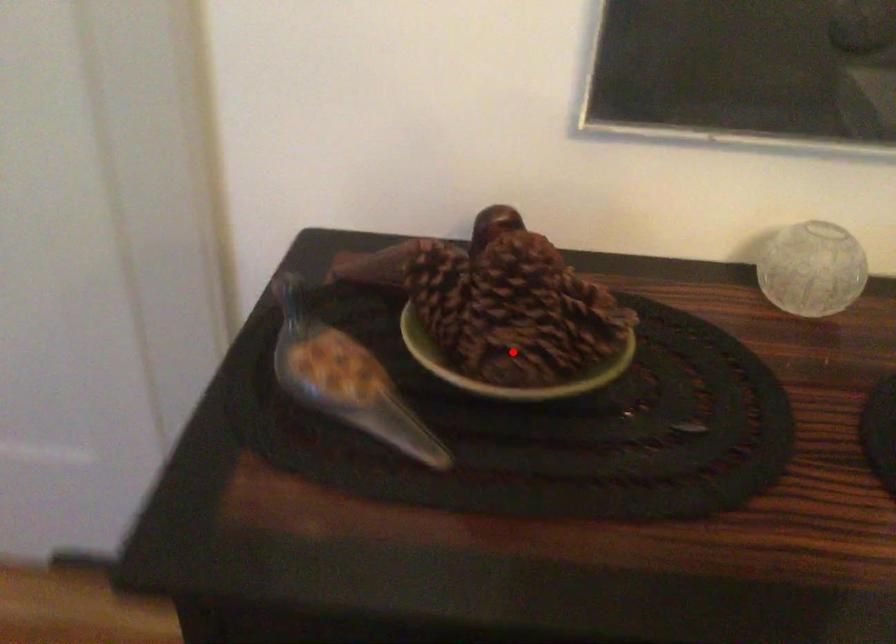
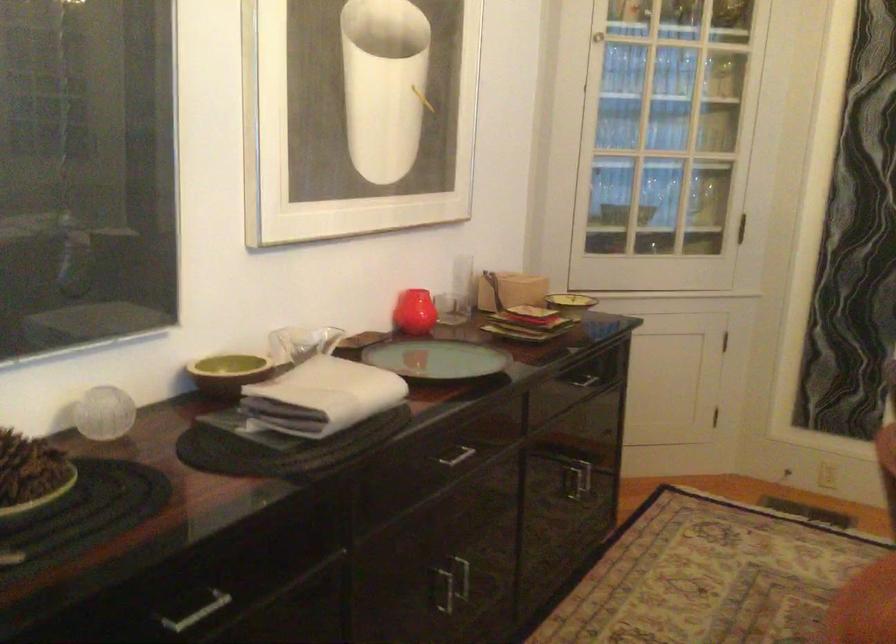
Where in the second image is the point corresponding to the highlighted location from the first image?

(30, 475)